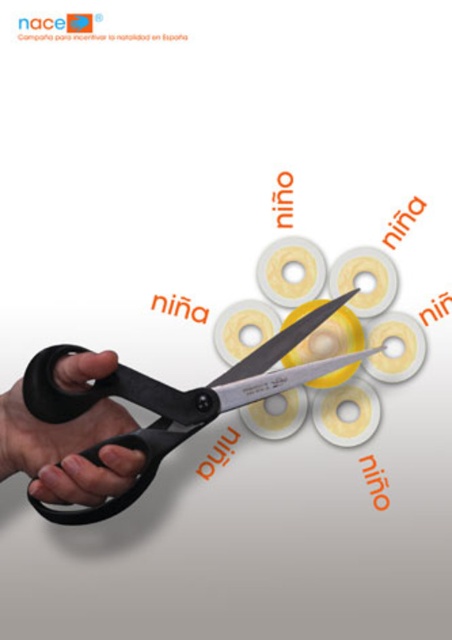
Question: Is the position of black plastic scissors at center less distant than that of black rubber hand at lower left?

Choices:
 (A) no
 (B) yes

Answer: (A)

Question: Which point is farther from the camera taking this photo?

Choices:
 (A) (84, 444)
 (B) (65, 416)

Answer: (A)

Question: Is black plastic scissors at center thinner than black rubber hand at lower left?

Choices:
 (A) no
 (B) yes

Answer: (A)

Question: Can you confirm if black plastic scissors at center is positioned to the left of black rubber hand at lower left?

Choices:
 (A) no
 (B) yes

Answer: (A)

Question: Which point is closer to the camera?

Choices:
 (A) (60, 385)
 (B) (318, 316)

Answer: (A)